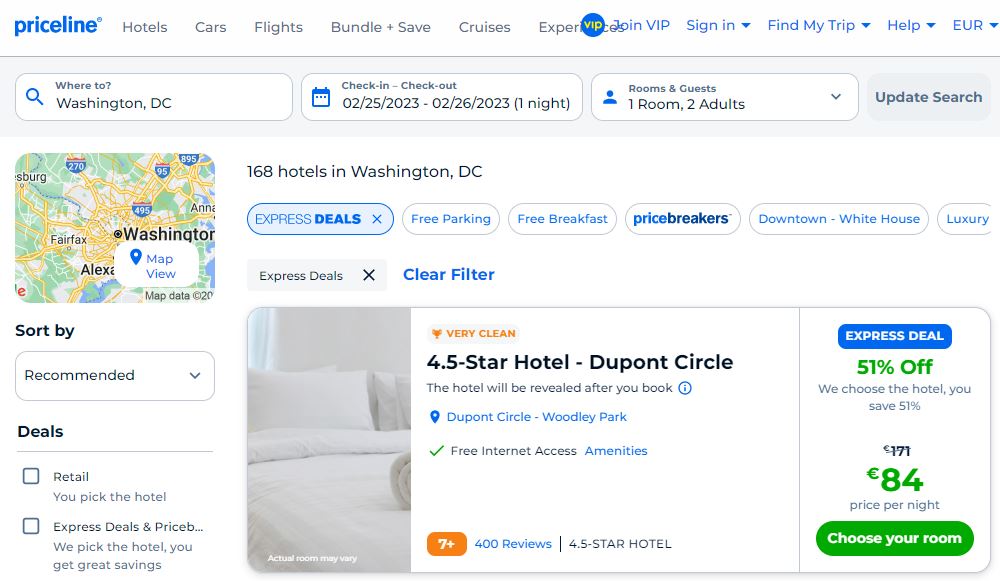
Where is `pillow`? pillow is located at coordinates (262, 172), (110, 372), (302, 392), (412, 277).